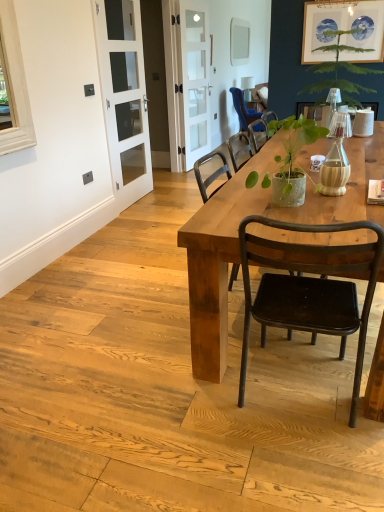
Question: Is white glass screen door at left, the first screen door positioned from the front, to the left or to the right of clear glass door at center, the 1th screen door in the back-to-front sequence, in the image?

Choices:
 (A) left
 (B) right

Answer: (A)

Question: Considering the positions of white glass screen door at left, the first screen door positioned from the front, and clear glass door at center, the second screen door in the left-to-right sequence, in the image, is white glass screen door at left, the first screen door positioned from the front, wider or thinner than clear glass door at center, the second screen door in the left-to-right sequence,?

Choices:
 (A) thin
 (B) wide

Answer: (B)

Question: Which object is the closest to the blue fabric chair at upper center, the first chair in the back-to-front sequence?

Choices:
 (A) green textured pot at center
 (B) white glass screen door at left, which is the second screen door in right-to-left order
 (C) wooden table at center
 (D) clear glass door at center, the second screen door in the left-to-right sequence
 (E) matte black chair at center, the 1th chair positioned from the bottom

Answer: (D)

Question: Which is nearer to the clear glass door at center, the 2th screen door positioned from the front?

Choices:
 (A) green leafy plant at upper right
 (B) blue fabric chair at upper center, the 2th chair from the front
 (C) wooden table at center
 (D) white glass screen door at left, which ranks as the 1th screen door in left-to-right order
 (E) matte gray power outlet at upper left

Answer: (B)